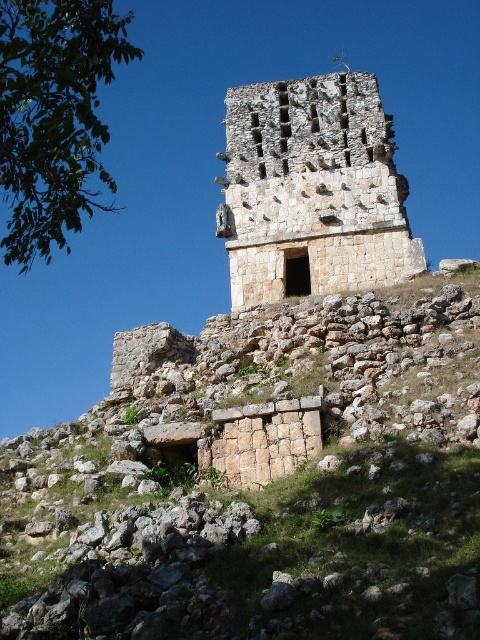
Is point (324, 492) more distant than point (226, 102)?

No, (324, 492) is in front of (226, 102).

Based on the photo, does rustic stone wall at center have a smaller size compared to rustic stone tower at center?

No, rustic stone wall at center is not smaller than rustic stone tower at center.

Does point (324, 497) come farther from viewer compared to point (244, 170)?

No, (324, 497) is closer to viewer.

At what (x,y) coordinates should I click in order to perform the action: click on rustic stone wall at center. Please return your answer as a coordinate pair (x, y). Looking at the image, I should click on (262, 477).